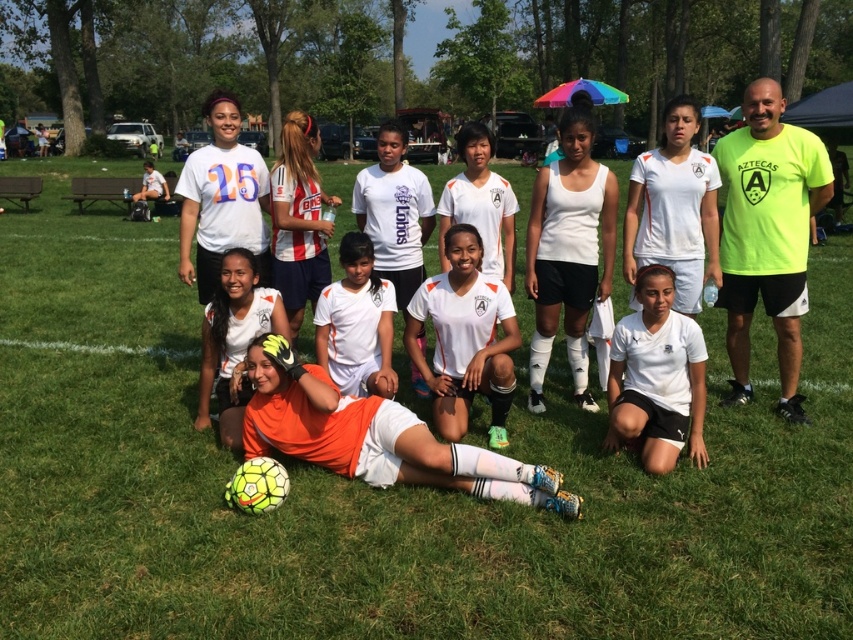
Between orange matte soccer ball at center and orange jersey at center, which one is positioned lower?

orange matte soccer ball at center is lower down.

Between point (405, 307) and point (209, 342), which one is positioned in front?

Point (209, 342)

Between point (227, 397) and point (245, 387), which one is positioned in front?

Point (245, 387) is more forward.

Locate an element on the screen. Image resolution: width=853 pixels, height=640 pixels. orange matte soccer ball at center is located at coordinates (364, 429).

Who is higher up, white matte soccer jersey at center or striped jersey at center?

striped jersey at center

Which is behind, point (358, 320) or point (296, 320)?

Point (296, 320)

Identify the location of white matte soccer jersey at center. The height and width of the screenshot is (640, 853). (357, 323).

The width and height of the screenshot is (853, 640). I want to click on white matte soccer jersey at center, so click(357, 323).

Is white matte tank top at center further to the viewer compared to white matte soccer jersey at center?

Yes, white matte tank top at center is further from the viewer.

Is white matte tank top at center smaller than white matte soccer jersey at center?

Yes, white matte tank top at center is smaller than white matte soccer jersey at center.

Between point (575, 368) and point (346, 337), which one is positioned behind?

Positioned behind is point (575, 368).

This screenshot has width=853, height=640. Identify the location of white matte tank top at center. (567, 250).